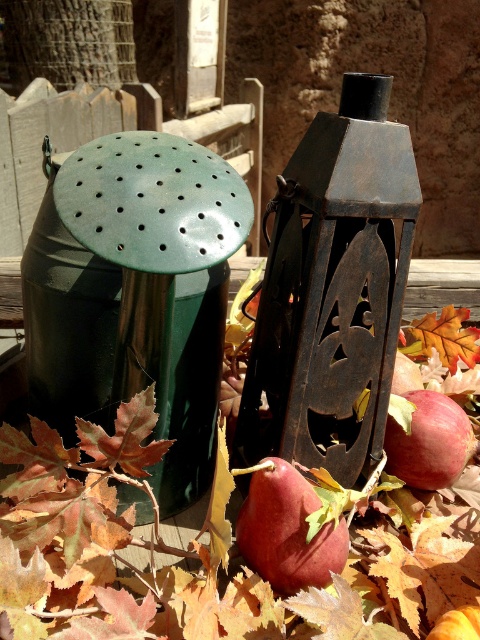
You are standing 5 feet away from the camera. Can you reach the matte red apple at lower right without moving your position?

The matte red apple at lower right is 33.16 inches away from the camera. Since you are standing 5 feet away from the camera, which is 60 inches, the apple is closer to you than your position. Therefore, you can reach it without moving.

You are standing at the origin point in the scene. Which of the two points, point (432, 420) or point (432, 324), is closer to you?

Point (432, 420) is in front of point (432, 324), so it is closer to you.

You are a squirrel gathering autumn fruits and leaves. You spot the shiny red apple at center and the orange matte maple leaf at lower right. Which item is closer to you as you approach from the front of the scene?

The shiny red apple at center is closer to you because it is positioned in front of the orange matte maple leaf at lower right.